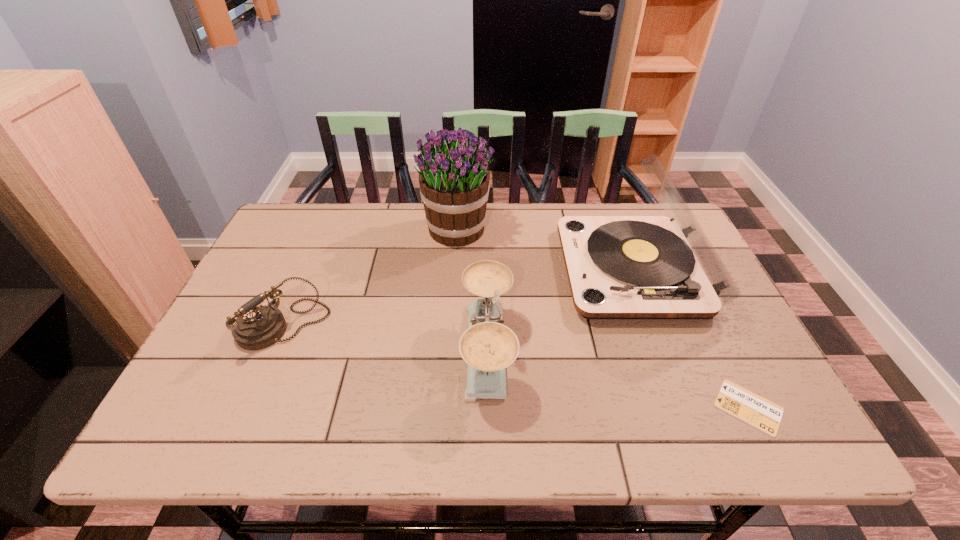
Where is `free space located on the front-facing side of the third shortest object`? This screenshot has height=540, width=960. free space located on the front-facing side of the third shortest object is located at coordinates tap(419, 350).

Image resolution: width=960 pixels, height=540 pixels. I want to click on free space located 0.160m on the front-facing side of the third shortest object, so click(393, 350).

Where is `blank area located 0.310m on the front-facing side of the third shortest object`? blank area located 0.310m on the front-facing side of the third shortest object is located at coordinates coord(328,350).

What are the coordinates of `free spot located 0.110m on the back of the fourth tallest object` in the screenshot? It's located at (307, 271).

Find the location of a particular element. vacant position located 0.250m on the left of the identity card is located at coordinates (595, 407).

Locate an element on the screen. The width and height of the screenshot is (960, 540). bouquet situated at the far edge is located at coordinates (454, 181).

Locate an element on the screen. Image resolution: width=960 pixels, height=540 pixels. record player located in the far edge section of the desktop is located at coordinates (619, 267).

You are a GUI agent. You are given a task and a screenshot of the screen. Output one action in this format:
    pyautogui.click(x=<x>, y=<y>)
    Task: Click on the scale positioned at the near edge
    This screenshot has height=540, width=960.
    Given the screenshot: What is the action you would take?
    pyautogui.click(x=488, y=347)

Find the location of `identity card that is at the near edge`. identity card that is at the near edge is located at coordinates (739, 402).

Where is `object present at the left edge`? Image resolution: width=960 pixels, height=540 pixels. object present at the left edge is located at coordinates [256, 328].